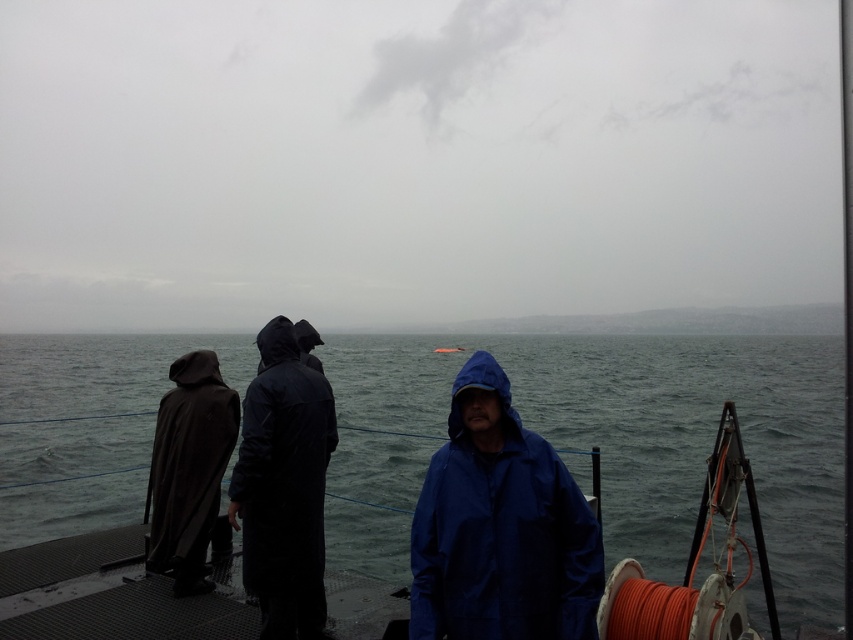
Does gray water at center have a greater width compared to dark matte raincoat at center?

Yes, gray water at center is wider than dark matte raincoat at center.

Which is behind, point (640, 444) or point (289, 627)?

The point (640, 444) is behind.

The width and height of the screenshot is (853, 640). Identify the location of gray water at center. (628, 435).

Which is more to the right, dark matte raincoat at center or dark matte trench coat at left?

From the viewer's perspective, dark matte raincoat at center appears more on the right side.

Does dark matte raincoat at center lie behind dark matte trench coat at left?

No, it is not.

Between point (292, 452) and point (178, 376), which one is positioned behind?

The point (178, 376) is behind.

Identify the location of dark matte raincoat at center. The width and height of the screenshot is (853, 640). (283, 486).

Is gray water at center bigger than blue waterproof jacket at center?

Correct, gray water at center is larger in size than blue waterproof jacket at center.

Can you confirm if gray water at center is positioned to the left of blue waterproof jacket at center?

Correct, you'll find gray water at center to the left of blue waterproof jacket at center.

The height and width of the screenshot is (640, 853). In order to click on gray water at center in this screenshot , I will do `click(628, 435)`.